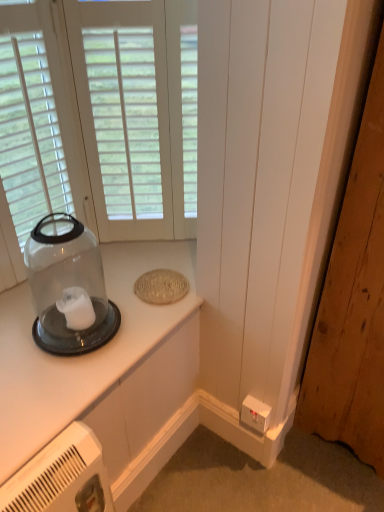
Question: From the image's perspective, is white wood window at upper left positioned above or below transparent glass jar at left?

Choices:
 (A) above
 (B) below

Answer: (A)

Question: Is white wood window at upper left in front of or behind transparent glass jar at left in the image?

Choices:
 (A) behind
 (B) front

Answer: (A)

Question: Based on their relative distances, which object is farther from the transparent glass jar at left?

Choices:
 (A) wooden door at lower right
 (B) white wood window at upper left
 (C) white plastic electric outlet at lower right
 (D) clear glass jar at upper left

Answer: (A)

Question: Based on their relative distances, which object is farther from the clear glass jar at upper left?

Choices:
 (A) wooden door at lower right
 (B) white wood window at upper left
 (C) white plastic electric outlet at lower right
 (D) transparent glass jar at left

Answer: (B)